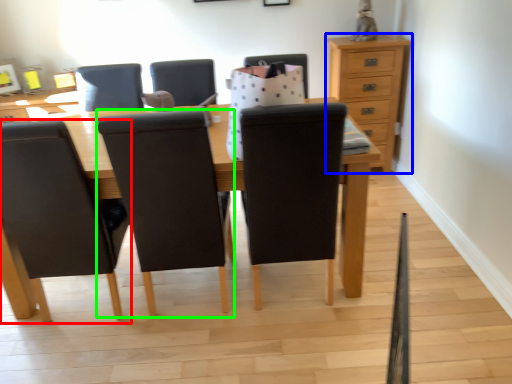
Question: Which is farther away from chair (highlighted by a red box)? chest of drawers (highlighted by a blue box) or chair (highlighted by a green box)?

Choices:
 (A) chest of drawers
 (B) chair

Answer: (A)